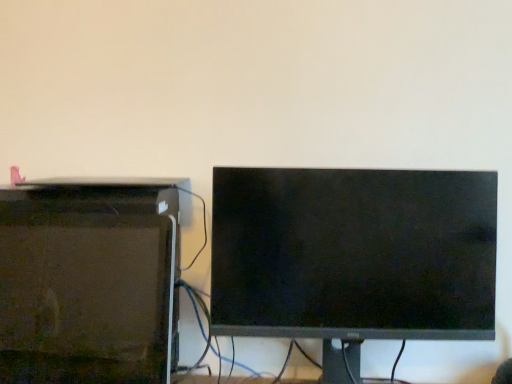
Question: Is black matte monitor at center positioned far away from matte black desktop computer at left?

Choices:
 (A) no
 (B) yes

Answer: (A)

Question: From a real-world perspective, is black matte monitor at center over matte black desktop computer at left?

Choices:
 (A) no
 (B) yes

Answer: (B)

Question: From a real-world perspective, is black matte monitor at center located beneath matte black desktop computer at left?

Choices:
 (A) no
 (B) yes

Answer: (A)

Question: Is matte black desktop computer at left located within black matte monitor at center?

Choices:
 (A) yes
 (B) no

Answer: (B)

Question: Can you confirm if black matte monitor at center is smaller than matte black desktop computer at left?

Choices:
 (A) no
 (B) yes

Answer: (A)

Question: Is black matte monitor at center wider than matte black desktop computer at left?

Choices:
 (A) yes
 (B) no

Answer: (A)

Question: Can you confirm if matte black desktop computer at left is positioned to the right of black matte monitor at center?

Choices:
 (A) no
 (B) yes

Answer: (A)

Question: Is matte black desktop computer at left positioned before black matte monitor at center?

Choices:
 (A) yes
 (B) no

Answer: (A)

Question: Can you confirm if matte black desktop computer at left is taller than black matte monitor at center?

Choices:
 (A) yes
 (B) no

Answer: (B)

Question: Can you confirm if matte black desktop computer at left is thinner than black matte monitor at center?

Choices:
 (A) no
 (B) yes

Answer: (B)

Question: Would you say matte black desktop computer at left contains black matte monitor at center?

Choices:
 (A) no
 (B) yes

Answer: (A)

Question: Would you say matte black desktop computer at left is a long distance from black matte monitor at center?

Choices:
 (A) yes
 (B) no

Answer: (B)

Question: Based on their sizes in the image, would you say matte black desktop computer at left is bigger or smaller than black matte monitor at center?

Choices:
 (A) big
 (B) small

Answer: (B)